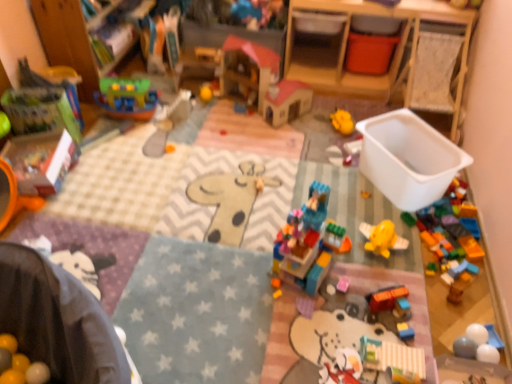
Locate an element on the screen. This screenshot has height=384, width=512. free space that is in between yellow rubber duck at center, which appears as the fifth toy when ordered from the bottom, and translucent plastic boat at upper left, the 4th toy viewed from the top is located at coordinates (244, 124).